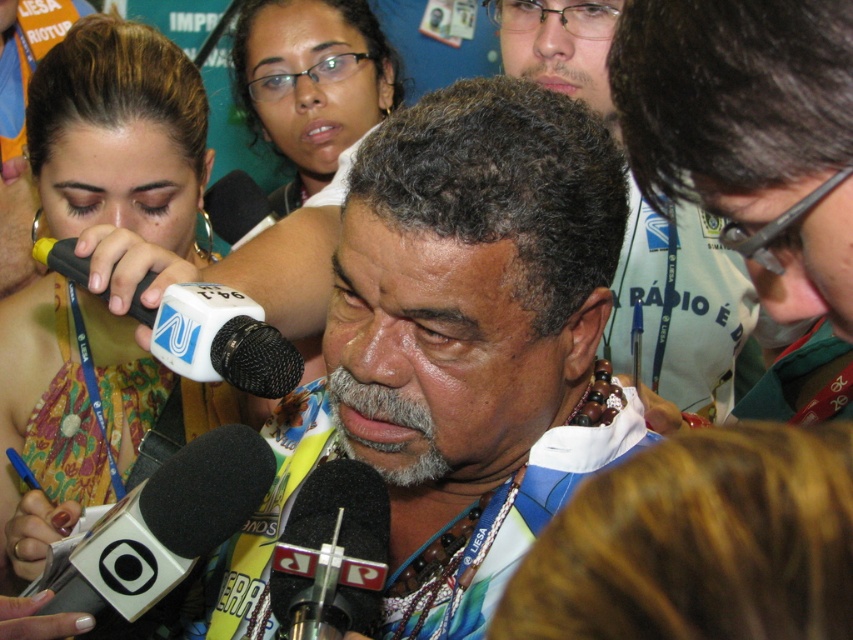
Does matte black glasses at upper center have a smaller size compared to black plastic microphone at center?

No, matte black glasses at upper center is not smaller than black plastic microphone at center.

Between point (363, 24) and point (312, 611), which one is positioned behind?

Positioned behind is point (363, 24).

Who is more distant from viewer, (x=347, y=36) or (x=375, y=572)?

The point (x=347, y=36) is more distant.

The width and height of the screenshot is (853, 640). Find the location of `matte black glasses at upper center`. matte black glasses at upper center is located at coordinates [x=311, y=83].

Is black plastic microphone at center thinner than white plastic microphone at center?

Indeed, black plastic microphone at center has a lesser width compared to white plastic microphone at center.

Who is more distant from viewer, (343, 572) or (276, 364)?

The point (276, 364) is behind.

Locate an element on the screen. black plastic microphone at center is located at coordinates (332, 554).

Is point (73, 433) closer to camera compared to point (663, 248)?

That is True.

Does matte yellow dress at center have a larger size compared to multicolored beaded necklace at center?

No.

Is point (148, 376) positioned before point (595, 56)?

No, (148, 376) is further to viewer.

Identify the location of matte yellow dress at center. (119, 134).